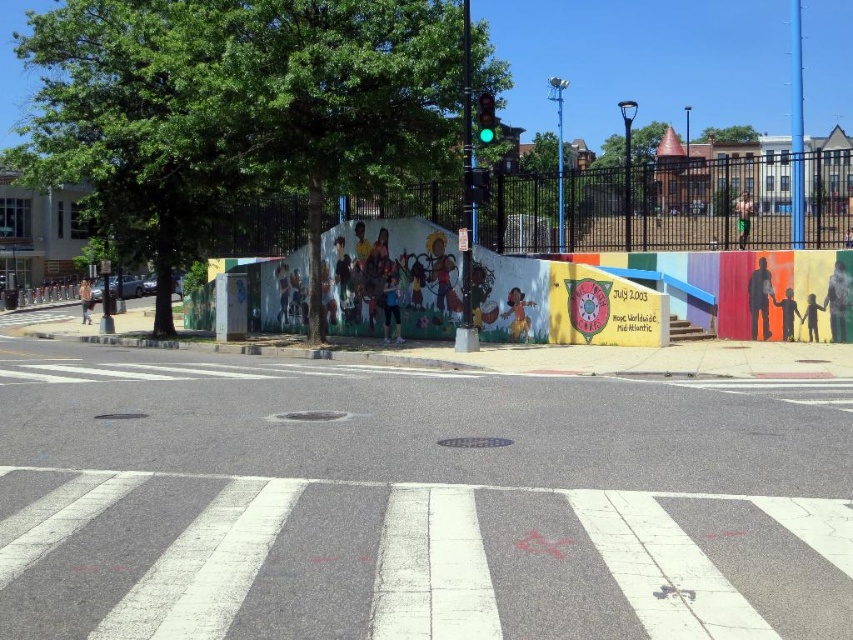
Question: Does gray asphalt at center have a larger size compared to green glass traffic light at upper center?

Choices:
 (A) yes
 (B) no

Answer: (A)

Question: Does gray asphalt at center appear on the left side of green glass traffic light at upper center?

Choices:
 (A) yes
 (B) no

Answer: (A)

Question: Is gray asphalt at center below green glass traffic light at upper center?

Choices:
 (A) yes
 (B) no

Answer: (A)

Question: Which of the following is the closest to the observer?

Choices:
 (A) gray asphalt at center
 (B) green glass traffic light at upper center

Answer: (A)

Question: Which point is farther from the camera taking this photo?

Choices:
 (A) (508, 509)
 (B) (482, 136)

Answer: (B)